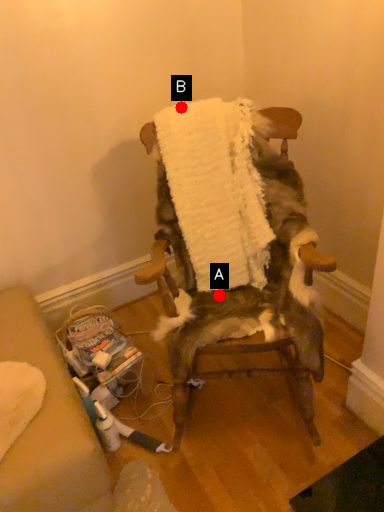
Question: Two points are circled on the image, labeled by A and B beside each circle. Which point is closer to the camera?

Choices:
 (A) A is closer
 (B) B is closer

Answer: (B)